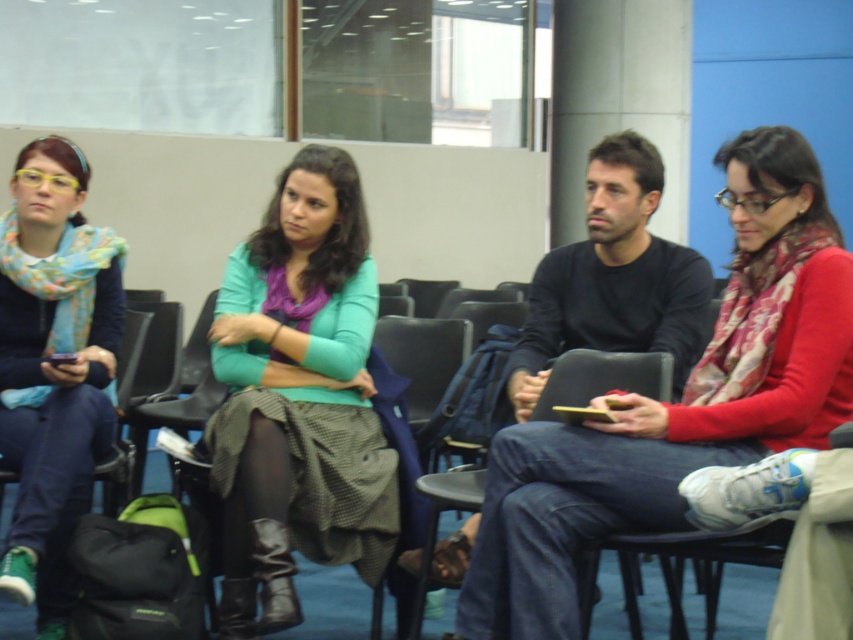
Question: Which of the following is the closest to the observer?

Choices:
 (A) teal sweater at center
 (B) black matte sweater at center

Answer: (A)

Question: Is teal sweater at center thinner than black matte sweater at center?

Choices:
 (A) no
 (B) yes

Answer: (B)

Question: Which point is farther to the camera?

Choices:
 (A) matte blue scarf at left
 (B) teal sweater at center

Answer: (A)

Question: Is teal sweater at center below matte blue scarf at left?

Choices:
 (A) yes
 (B) no

Answer: (A)

Question: Is teal sweater at center positioned behind matte blue scarf at left?

Choices:
 (A) yes
 (B) no

Answer: (B)

Question: Among these points, which one is farthest from the camera?

Choices:
 (A) (608, 164)
 (B) (83, 429)

Answer: (A)